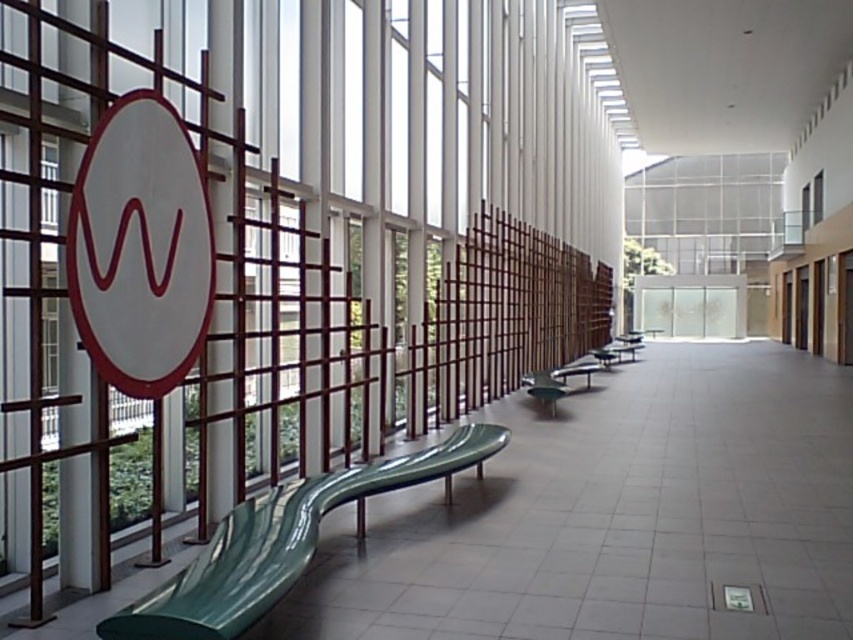
Looking at this image, you are a maintenance worker needing to replace a bench. You have a new bench that is 1.5 meters wide. Which bench between the green glossy bench at lower left and the green glossy bench at center should you replace if the new bench must fit exactly in the space?

The new bench that is 1.5 meters wide should replace the green glossy bench at center because the green glossy bench at lower left is wider than the green glossy bench at center, so the new bench would fit better in the space of the center bench.

You are walking down the corridor and notice the white matte sign at upper left and the green glossy bench at lower left. Which object is positioned further to the left side of the corridor?

The white matte sign at upper left is positioned further to the left side of the corridor than the green glossy bench at lower left.